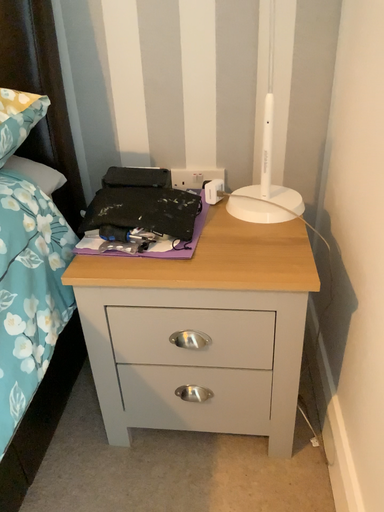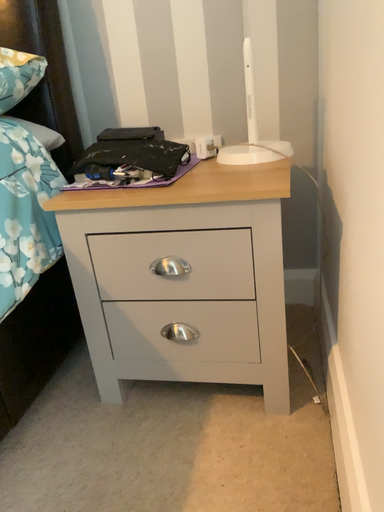
Question: How did the camera likely rotate when shooting the video?

Choices:
 (A) rotated upward
 (B) rotated downward

Answer: (A)